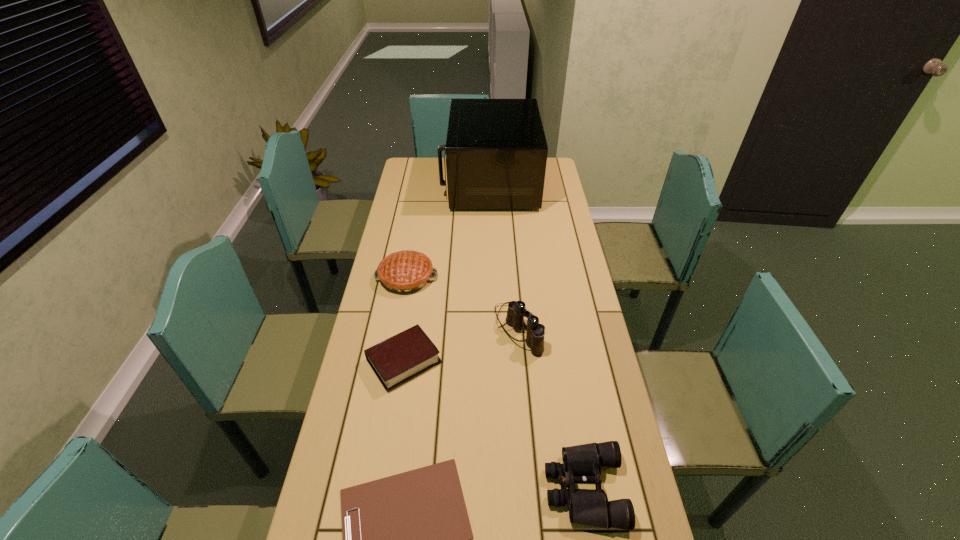
The width and height of the screenshot is (960, 540). Identify the location of free space between the tallest object and the farther binoculars. (504, 256).

The image size is (960, 540). In order to click on vacant point located between the fourth shortest object and the fifth tallest object in this screenshot , I will do `click(405, 319)`.

This screenshot has width=960, height=540. In order to click on blank region between the second shortest object and the microwave_oven in this screenshot , I will do `click(446, 272)`.

You are a GUI agent. You are given a task and a screenshot of the screen. Output one action in this format:
    pyautogui.click(x=<x>, y=<y>)
    Task: Click on the object that is the second closest to the fifth tallest object
    This screenshot has height=540, width=960.
    Given the screenshot: What is the action you would take?
    pyautogui.click(x=406, y=271)

Find the location of `object that ranks as the third closest to the Bible`. object that ranks as the third closest to the Bible is located at coordinates (406, 538).

Locate an element on the screen. The height and width of the screenshot is (540, 960). free space that satisfies the following two spatial constraints: 1. on the front-facing side of the microwave_oven; 2. on the right side of the fifth shortest object is located at coordinates (493, 329).